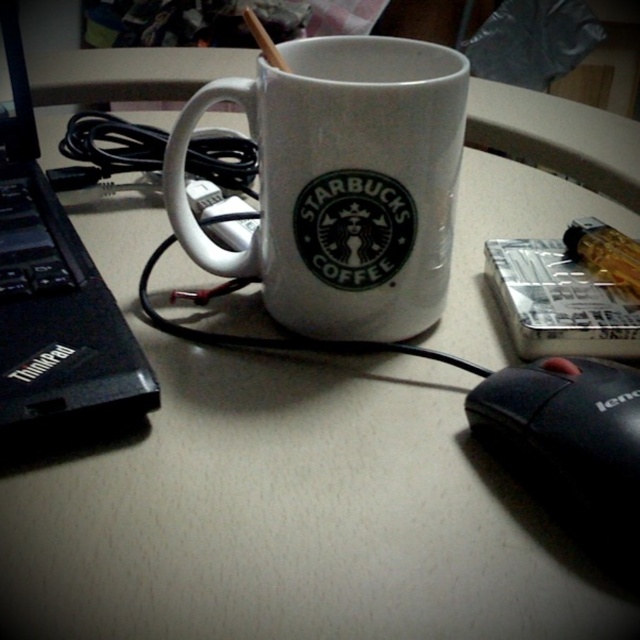
Can you confirm if white ceramic mug at center is positioned to the right of black plastic thinkpad at left?

Yes, white ceramic mug at center is to the right of black plastic thinkpad at left.

Who is shorter, white ceramic mug at center or black plastic thinkpad at left?

Standing shorter between the two is white ceramic mug at center.

Find the location of a particular element. This screenshot has width=640, height=640. white ceramic mug at center is located at coordinates (342, 182).

Can you confirm if black plastic thinkpad at left is positioned above black matte mouse at lower right?

Yes, black plastic thinkpad at left is above black matte mouse at lower right.

In the scene shown: Who is taller, black plastic thinkpad at left or black matte mouse at lower right?

Standing taller between the two is black plastic thinkpad at left.

The width and height of the screenshot is (640, 640). I want to click on black plastic thinkpad at left, so click(52, 296).

In order to click on black plastic thinkpad at left in this screenshot , I will do `click(52, 296)`.

Who is more distant from viewer, [371,189] or [522,433]?

The point [371,189] is more distant.

Which of these two, white ceramic mug at center or black matte mouse at lower right, stands taller?

white ceramic mug at center

Which is in front, point (333, 232) or point (609, 496)?

Point (609, 496) is in front.

I want to click on white ceramic mug at center, so click(342, 182).